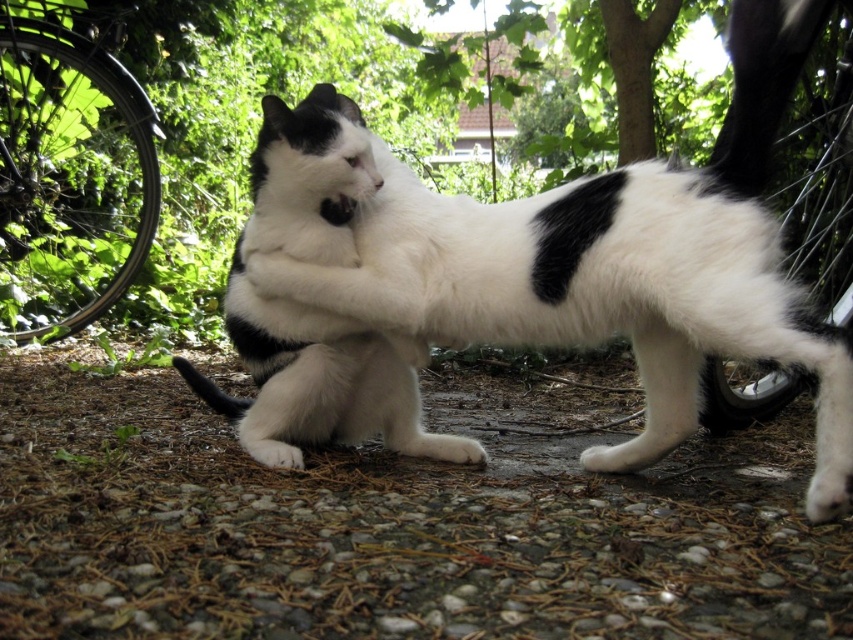
Which is below, black rubber tire at left or black rubber tire at right?

black rubber tire at right

Who is positioned more to the right, black rubber tire at left or black rubber tire at right?

Positioned to the right is black rubber tire at right.

Between point (57, 29) and point (796, 227), which one is positioned in front?

Point (57, 29)

The image size is (853, 640). Identify the location of black rubber tire at left. (68, 177).

Can you confirm if black rubber tire at upper left is positioned below white soft fur cat at center?

No.

Does black rubber tire at upper left have a larger size compared to white soft fur cat at center?

Yes.

Where is `black rubber tire at upper left`? Image resolution: width=853 pixels, height=640 pixels. black rubber tire at upper left is located at coordinates (68, 177).

Can you confirm if black rubber tire at upper left is bigger than black rubber tire at right?

Yes.

Between point (10, 90) and point (779, 195), which one is positioned in front?

Positioned in front is point (779, 195).

This screenshot has width=853, height=640. I want to click on black rubber tire at upper left, so click(x=68, y=177).